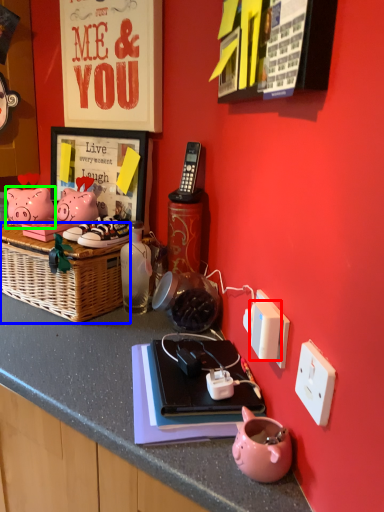
Question: Considering the real-world distances, which object is closest to light switch (highlighted by a red box)? picnic basket (highlighted by a blue box) or pig (highlighted by a green box).

Choices:
 (A) picnic basket
 (B) pig

Answer: (A)